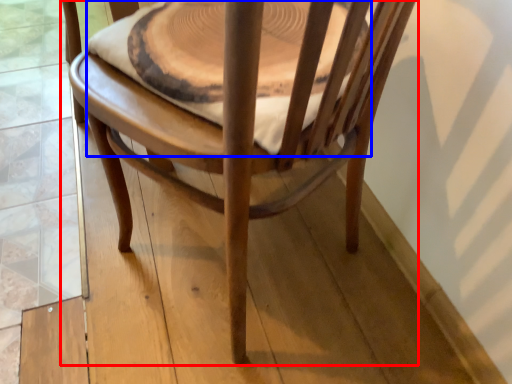
Question: Which of the following is the farthest to the observer, chair (highlighted by a red box) or round table (highlighted by a blue box)?

Choices:
 (A) chair
 (B) round table

Answer: (B)